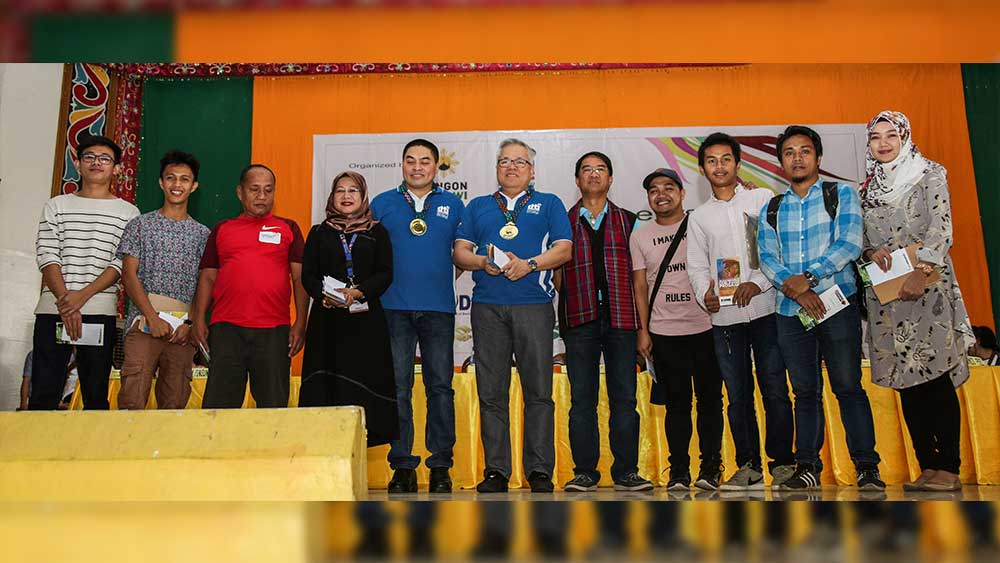
At what (x,y) coordinates should I click in order to perform the action: click on orange wall. Please return your answer as a coordinate pair (x, y). This screenshot has width=1000, height=563. Looking at the image, I should click on (303, 120).